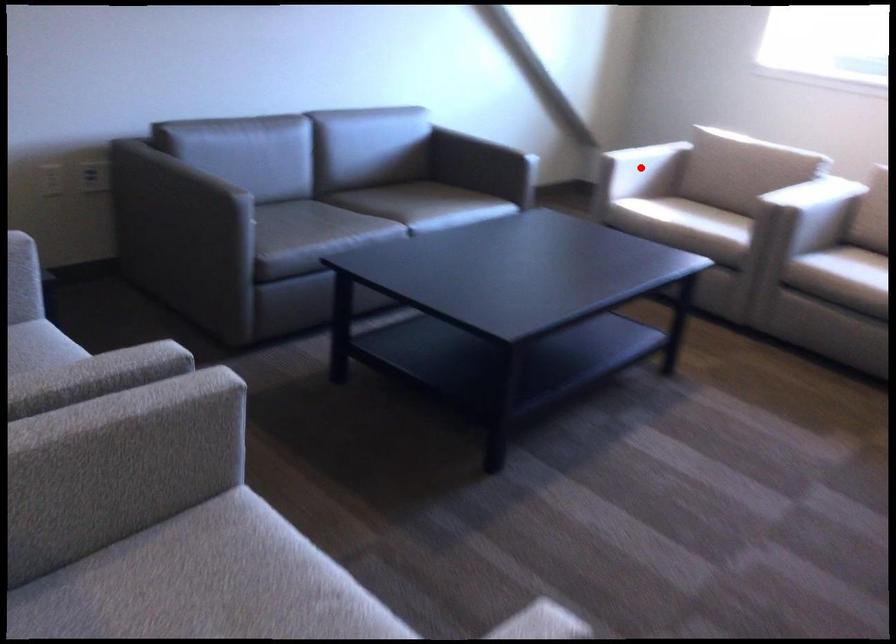
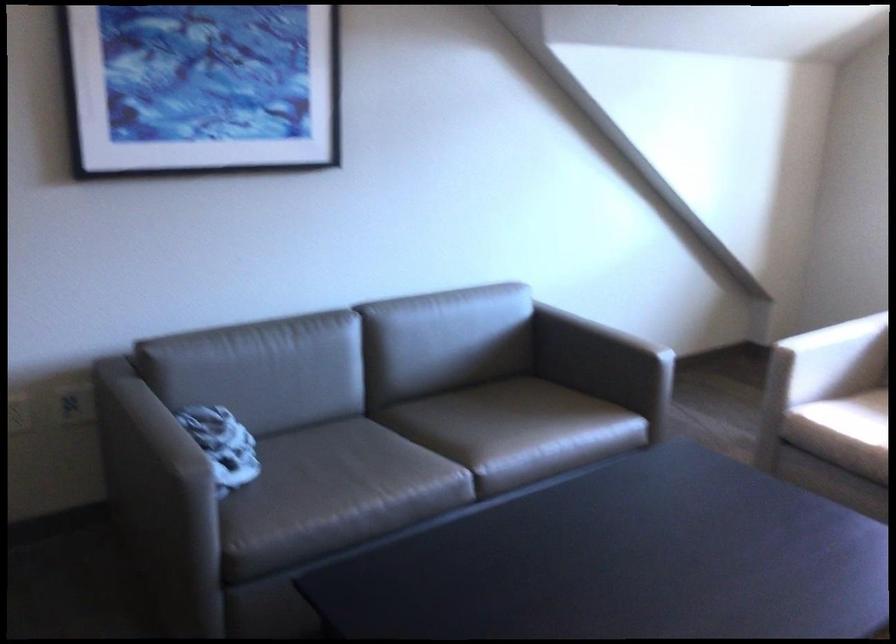
In the second image, find the point that corresponds to the highlighted location in the first image.

(831, 359)